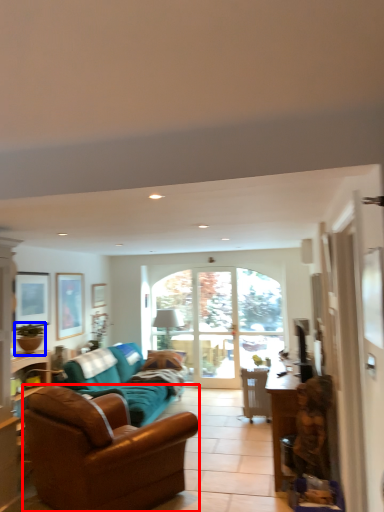
Question: Which object is closer to the camera taking this photo, studio couch (highlighted by a red box) or houseplant (highlighted by a blue box)?

Choices:
 (A) studio couch
 (B) houseplant

Answer: (A)